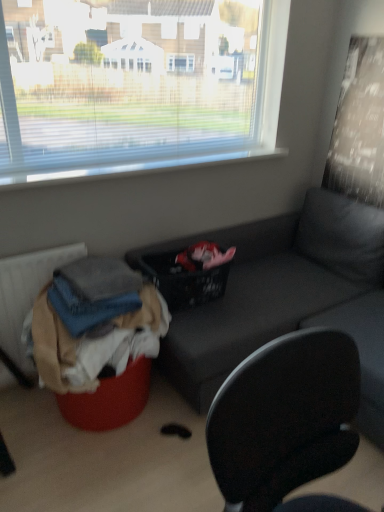
Locate an element on the screen. free point above denim fabric at lower left, which is the second clothing in bottom-to-top order (from a real-world perspective) is located at coordinates (94, 278).